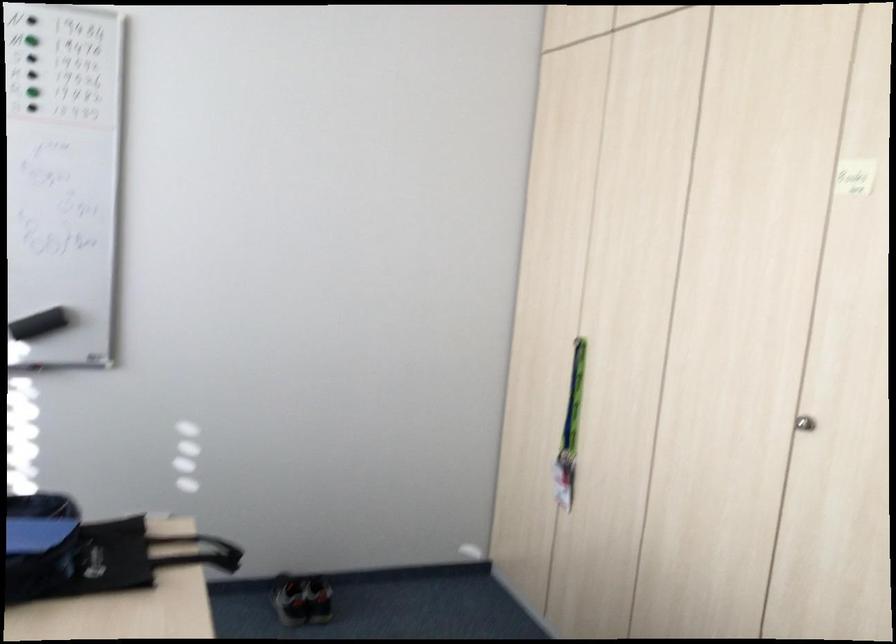
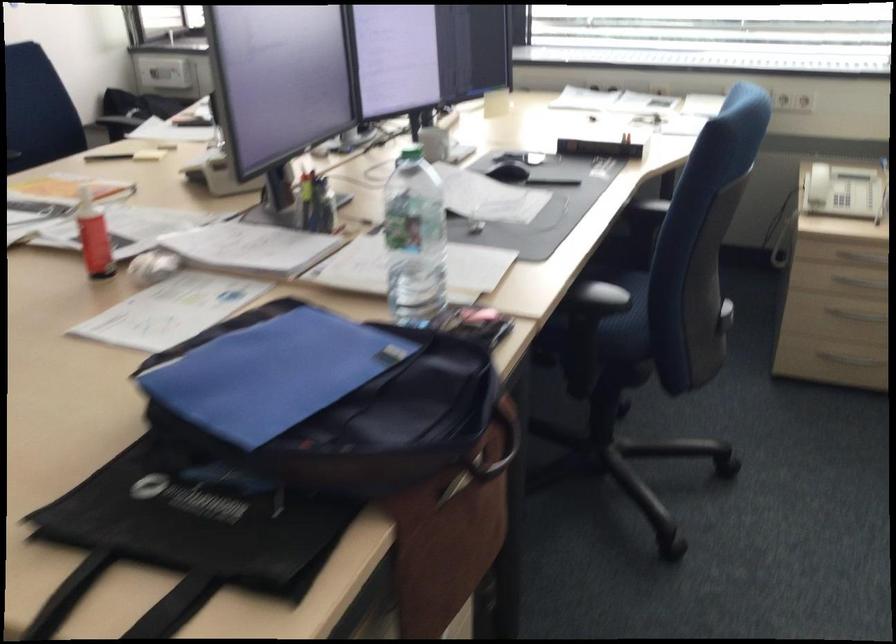
Where in the second image is the point corresponding to point 167,552 from the first image?

(124, 601)